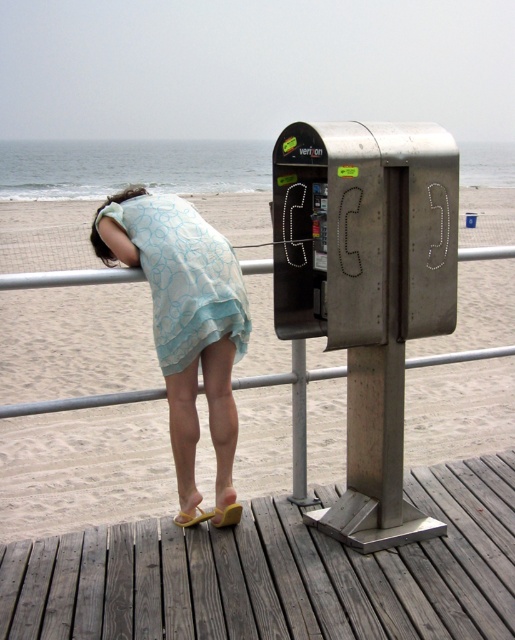
Does light blue fabric dress at center have a lesser height compared to yellow rubber sandal at lower center?

No, light blue fabric dress at center is not shorter than yellow rubber sandal at lower center.

Does point (233, 262) come farther from viewer compared to point (214, 524)?

No, it is not.

The width and height of the screenshot is (515, 640). Find the location of `light blue fabric dress at center`. light blue fabric dress at center is located at coordinates click(184, 317).

Who is lower down, light blue sheer dress at center or yellow rubber sandal at lower center?

Positioned lower is yellow rubber sandal at lower center.

Locate an element on the screen. Image resolution: width=515 pixels, height=640 pixels. light blue sheer dress at center is located at coordinates (183, 275).

Who is more distant from viewer, [193,323] or [225,506]?

The point [225,506] is behind.

Identify the location of light blue sheer dress at center. Image resolution: width=515 pixels, height=640 pixels. (183, 275).

Is light blue sheer dress at center taller than yellow matte sandal at lower center?

Yes, light blue sheer dress at center is taller than yellow matte sandal at lower center.

The image size is (515, 640). Identify the location of light blue sheer dress at center. (183, 275).